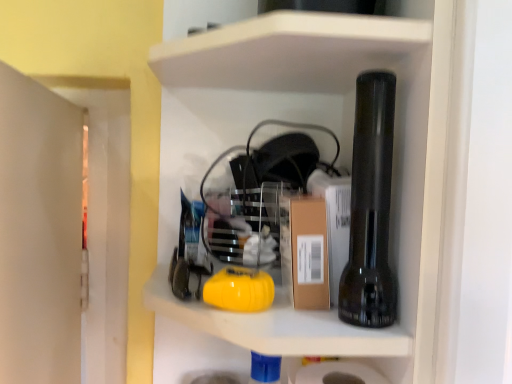
Measure the distance between point (x=361, y=84) and camera.

A distance of 16.65 inches exists between point (x=361, y=84) and camera.

This screenshot has height=384, width=512. What are the coordinates of `black matte beer bottle at right` in the screenshot? It's located at click(370, 207).

The image size is (512, 384). Describe the element at coordinates (370, 207) in the screenshot. I see `black matte beer bottle at right` at that location.

This screenshot has height=384, width=512. Describe the element at coordinates (305, 251) in the screenshot. I see `brown cardboard box at center` at that location.

Measure the distance between point (307, 249) and camera.

A distance of 18.39 inches exists between point (307, 249) and camera.

In order to click on brown cardboard box at center in this screenshot , I will do `click(305, 251)`.

Locate an element on the screen. This screenshot has height=384, width=512. black matte beer bottle at right is located at coordinates (370, 207).

Considering the relative positions of black matte beer bottle at right and brown cardboard box at center in the image provided, is black matte beer bottle at right to the right of brown cardboard box at center from the viewer's perspective?

Yes.

Which object is closer to the camera, black matte beer bottle at right or brown cardboard box at center?

black matte beer bottle at right is in front.

Does point (356, 265) lie in front of point (303, 259)?

That is True.

From the image's perspective, which is above, black matte beer bottle at right or brown cardboard box at center?

black matte beer bottle at right appears higher in the image.

From a real-world perspective, is black matte beer bottle at right on top of brown cardboard box at center?

Indeed, from a real-world perspective, black matte beer bottle at right stands above brown cardboard box at center.

Considering the sizes of objects black matte beer bottle at right and brown cardboard box at center in the image provided, who is wider, black matte beer bottle at right or brown cardboard box at center?

black matte beer bottle at right.

Is black matte beer bottle at right shorter than brown cardboard box at center?

In fact, black matte beer bottle at right may be taller than brown cardboard box at center.

Does black matte beer bottle at right have a smaller size compared to brown cardboard box at center?

Actually, black matte beer bottle at right might be larger than brown cardboard box at center.

Is brown cardboard box at center completely or partially inside black matte beer bottle at right?

No, brown cardboard box at center is located outside of black matte beer bottle at right.

Is black matte beer bottle at right beside brown cardboard box at center?

Yes, black matte beer bottle at right is with brown cardboard box at center.

Is black matte beer bottle at right facing towards brown cardboard box at center?

No, black matte beer bottle at right is not turned towards brown cardboard box at center.

How many degrees apart are the facing directions of black matte beer bottle at right and brown cardboard box at center?

The angle between the facing direction of black matte beer bottle at right and the facing direction of brown cardboard box at center is 0.00558 degrees.

Identify the location of beer bottle located above the brown cardboard box at center (from the image's perspective). This screenshot has width=512, height=384. (370, 207).

Is brown cardboard box at center to the right of black matte beer bottle at right from the viewer's perspective?

Incorrect, brown cardboard box at center is not on the right side of black matte beer bottle at right.

Between brown cardboard box at center and black matte beer bottle at right, which one is positioned in front?

black matte beer bottle at right.

Considering the positions of point (304, 210) and point (354, 262), is point (304, 210) closer or farther from the camera than point (354, 262)?

Point (304, 210) is farther from the camera than point (354, 262).

From the image's perspective, which is below, brown cardboard box at center or black matte beer bottle at right?

brown cardboard box at center.

Based on the photo, from a real-world perspective, does brown cardboard box at center stand above black matte beer bottle at right?

No.

Which object is wider, brown cardboard box at center or black matte beer bottle at right?

With larger width is black matte beer bottle at right.

Does brown cardboard box at center have a lesser height compared to black matte beer bottle at right?

Yes, brown cardboard box at center is shorter than black matte beer bottle at right.

Consider the image. Considering the sizes of objects brown cardboard box at center and black matte beer bottle at right in the image provided, who is smaller, brown cardboard box at center or black matte beer bottle at right?

brown cardboard box at center.

Is brown cardboard box at center not within black matte beer bottle at right?

brown cardboard box at center is positioned outside black matte beer bottle at right.

Looking at this image, are brown cardboard box at center and black matte beer bottle at right far apart?

brown cardboard box at center is actually quite close to black matte beer bottle at right.

Is brown cardboard box at center aimed at black matte beer bottle at right?

No, brown cardboard box at center is not oriented towards black matte beer bottle at right.

Can you tell me how much brown cardboard box at center and black matte beer bottle at right differ in facing direction?

There is a 0.00558-degree angle between the facing directions of brown cardboard box at center and black matte beer bottle at right.

Where is `cardboard box lying behind the black matte beer bottle at right`? cardboard box lying behind the black matte beer bottle at right is located at coordinates (305, 251).

In the image, there is a black matte beer bottle at right. Identify the location of cardboard box below it (from a real-world perspective). (305, 251).

At what (x,y) coordinates should I click in order to perform the action: click on cardboard box behind the black matte beer bottle at right. Please return your answer as a coordinate pair (x, y). The image size is (512, 384). Looking at the image, I should click on (305, 251).